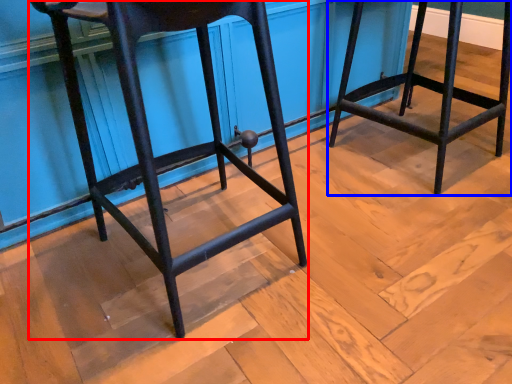
Question: Among these objects, which one is nearest to the camera, furniture (highlighted by a red box) or furniture (highlighted by a blue box)?

Choices:
 (A) furniture
 (B) furniture

Answer: (A)